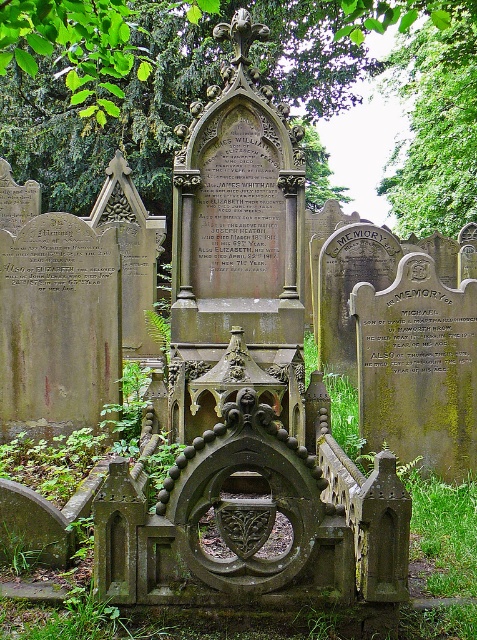
You are standing at the entrance of the cemetery and want to find the green leafy tree at center. According to the scene description, where should you look relative to the central gravestone?

The green leafy tree at center is located at point coordinates relative to the central gravestone, but since the exact spatial relationship isn